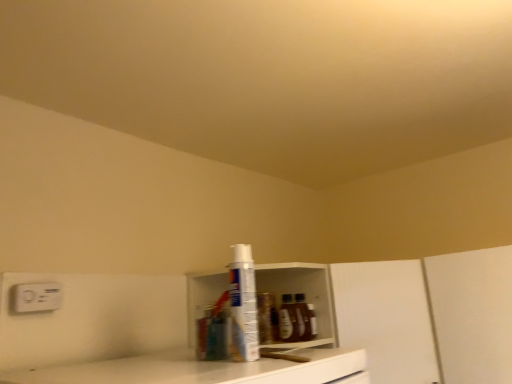
Question: Is white plastic shelf at center at the right side of white plastic spray can at center?

Choices:
 (A) no
 (B) yes

Answer: (B)

Question: From the image's perspective, is white plastic shelf at center below white plastic spray can at center?

Choices:
 (A) yes
 (B) no

Answer: (A)

Question: Is white plastic shelf at center bigger than white plastic spray can at center?

Choices:
 (A) no
 (B) yes

Answer: (B)

Question: From the image's perspective, is white plastic shelf at center over white plastic spray can at center?

Choices:
 (A) yes
 (B) no

Answer: (B)

Question: Can you confirm if white plastic shelf at center is shorter than white plastic spray can at center?

Choices:
 (A) no
 (B) yes

Answer: (A)

Question: Is white plastic shelf at center at the left side of white plastic spray can at center?

Choices:
 (A) yes
 (B) no

Answer: (B)

Question: Is white plastic electric outlet at upper left oriented away from white matte cabinet at center?

Choices:
 (A) yes
 (B) no

Answer: (B)

Question: From the image's perspective, is white plastic electric outlet at upper left on top of white matte cabinet at center?

Choices:
 (A) yes
 (B) no

Answer: (A)

Question: Could you tell me if white plastic electric outlet at upper left is turned towards white matte cabinet at center?

Choices:
 (A) yes
 (B) no

Answer: (B)

Question: Is white plastic electric outlet at upper left wider than white matte cabinet at center?

Choices:
 (A) no
 (B) yes

Answer: (A)

Question: From a real-world perspective, is white plastic electric outlet at upper left physically above white matte cabinet at center?

Choices:
 (A) no
 (B) yes

Answer: (B)

Question: Does white plastic electric outlet at upper left appear on the left side of white matte cabinet at center?

Choices:
 (A) yes
 (B) no

Answer: (A)

Question: Does white matte cabinet at center come behind white plastic electric outlet at upper left?

Choices:
 (A) no
 (B) yes

Answer: (B)